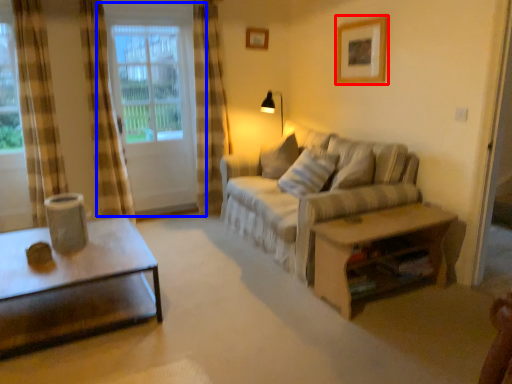
Question: Which point is closer to the camera, picture frame (highlighted by a red box) or window (highlighted by a blue box)?

Choices:
 (A) picture frame
 (B) window

Answer: (A)